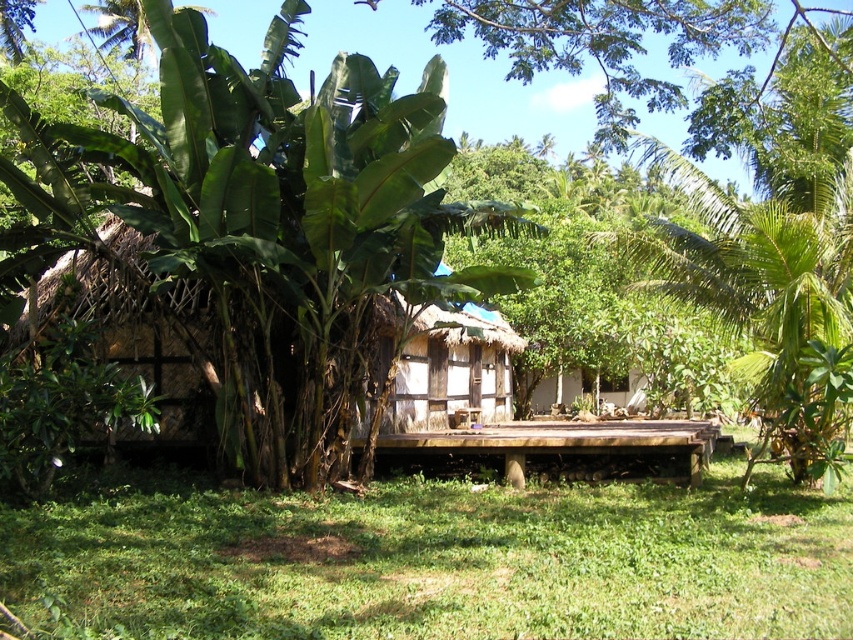
Question: Can you confirm if green grass at center is wider than green leafy banana tree at center?

Choices:
 (A) yes
 (B) no

Answer: (A)

Question: Does green grass at center appear on the right side of green leafy banana tree at center?

Choices:
 (A) yes
 (B) no

Answer: (A)

Question: Which object appears farthest from the camera in this image?

Choices:
 (A) green grass at center
 (B) green leafy banana tree at center

Answer: (B)

Question: Which of the following is the farthest from the observer?

Choices:
 (A) green leafy banana tree at center
 (B) green grass at center

Answer: (A)

Question: Is green grass at center smaller than green leafy banana tree at center?

Choices:
 (A) no
 (B) yes

Answer: (A)

Question: Which point is closer to the camera?

Choices:
 (A) (535, 572)
 (B) (386, 282)

Answer: (A)